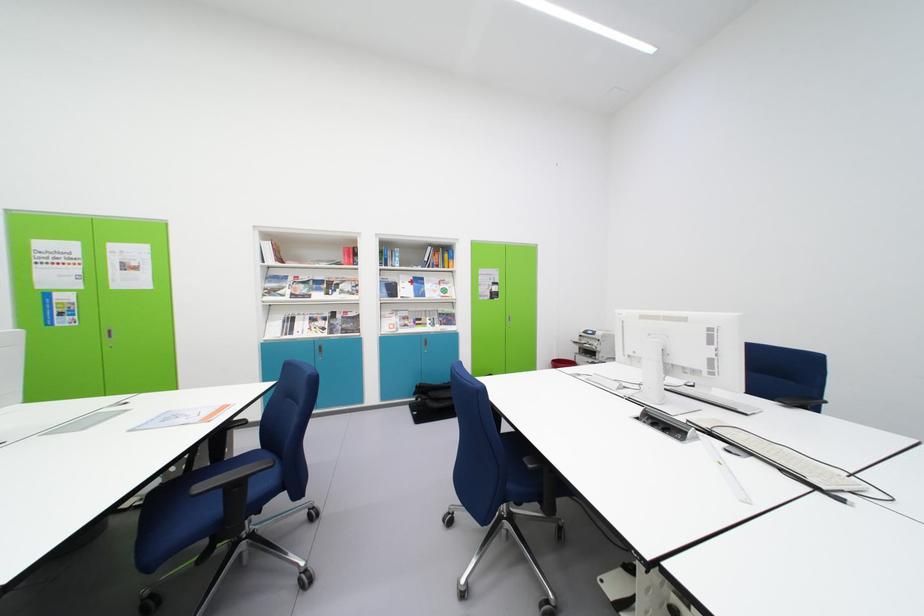
Find where to lift the black laptop bag. Please return your answer as a coordinate pair (x, y).

(431, 402)